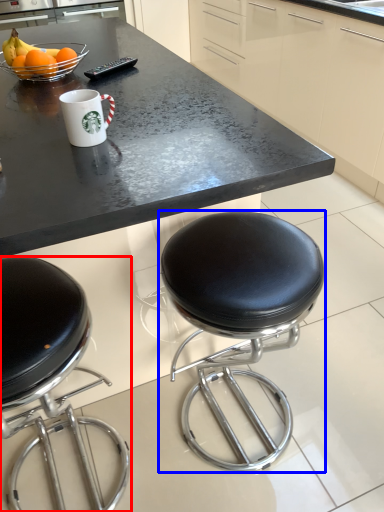
Question: Which of the following is the farthest to the observer, chair (highlighted by a red box) or stool (highlighted by a blue box)?

Choices:
 (A) chair
 (B) stool

Answer: (B)